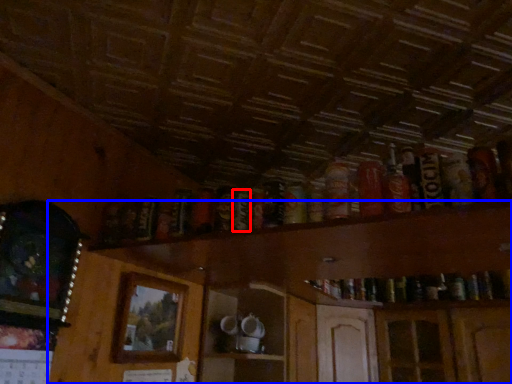
Question: Which point is closer to the camera, beer (highlighted by a red box) or dresser (highlighted by a blue box)?

Choices:
 (A) beer
 (B) dresser

Answer: (B)